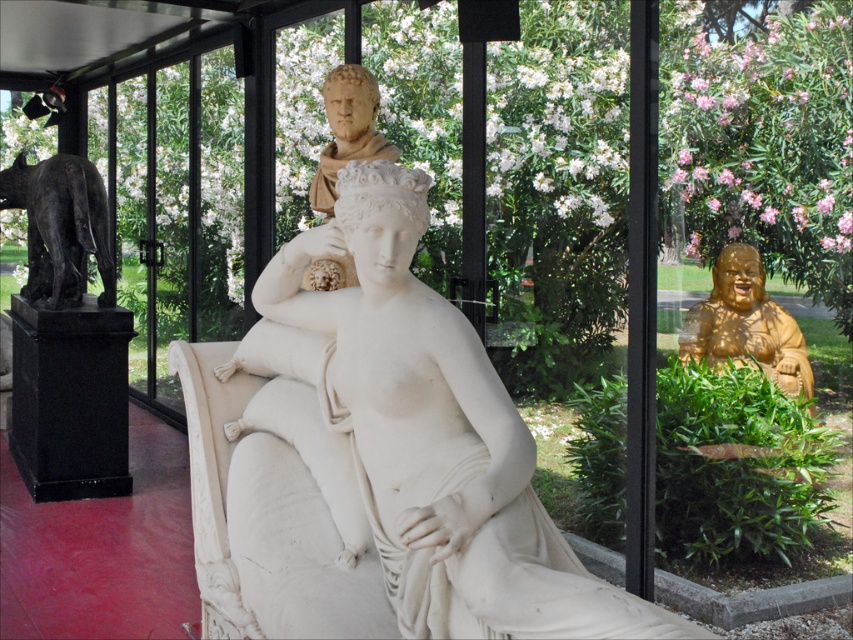
Which is in front, point (498, 452) or point (737, 342)?

Point (498, 452) is in front.

Does white marble statue at center appear over gold polished statue at right?

Actually, white marble statue at center is below gold polished statue at right.

This screenshot has width=853, height=640. Describe the element at coordinates (416, 435) in the screenshot. I see `white marble statue at center` at that location.

The height and width of the screenshot is (640, 853). What are the coordinates of `white marble statue at center` in the screenshot? It's located at (416, 435).

Does bronze statue at left appear on the left side of gold polished statue at right?

Yes, bronze statue at left is to the left of gold polished statue at right.

Does bronze statue at left have a lesser height compared to gold polished statue at right?

Incorrect, bronze statue at left's height does not fall short of gold polished statue at right's.

Which is in front, point (74, 189) or point (763, 362)?

Positioned in front is point (763, 362).

Identify the location of bronze statue at left. The image size is (853, 640). (61, 227).

Image resolution: width=853 pixels, height=640 pixels. What do you see at coordinates (416, 435) in the screenshot? I see `white marble statue at center` at bounding box center [416, 435].

Where is `white marble statue at center`? white marble statue at center is located at coordinates (416, 435).

Locate an element on the screen. white marble statue at center is located at coordinates (416, 435).